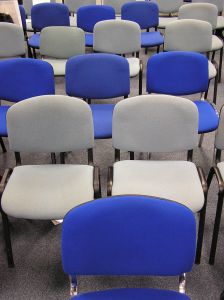
Identify the location of chairs in fourth row. (65, 37), (120, 37), (188, 31), (12, 44).